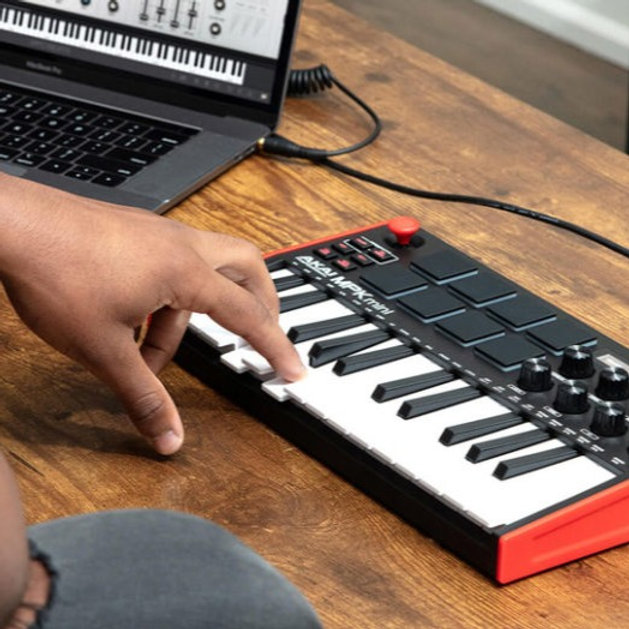
The height and width of the screenshot is (629, 629). Identify the location of squares on keyboard. (391, 287), (455, 263), (476, 291), (502, 308), (553, 334), (513, 348), (470, 329), (441, 313).